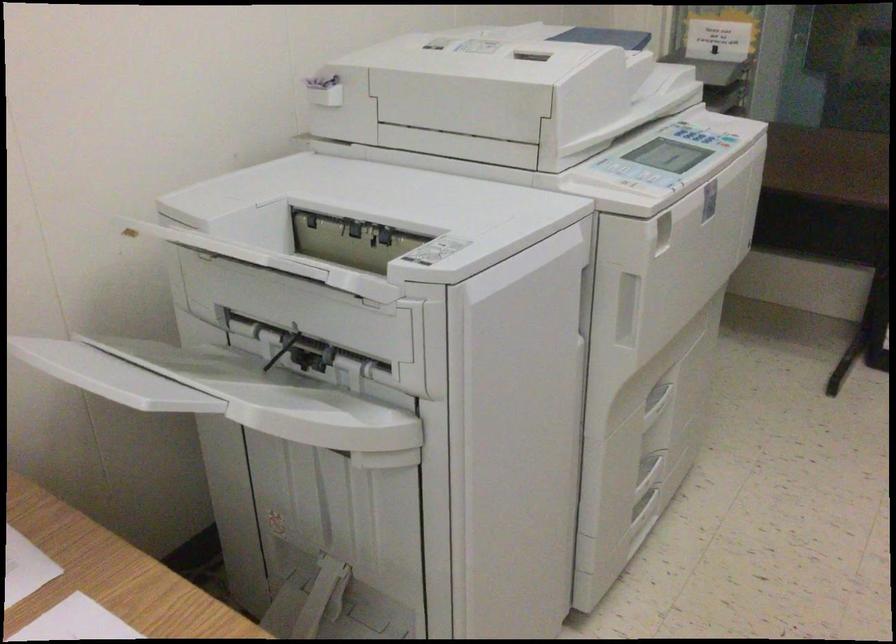
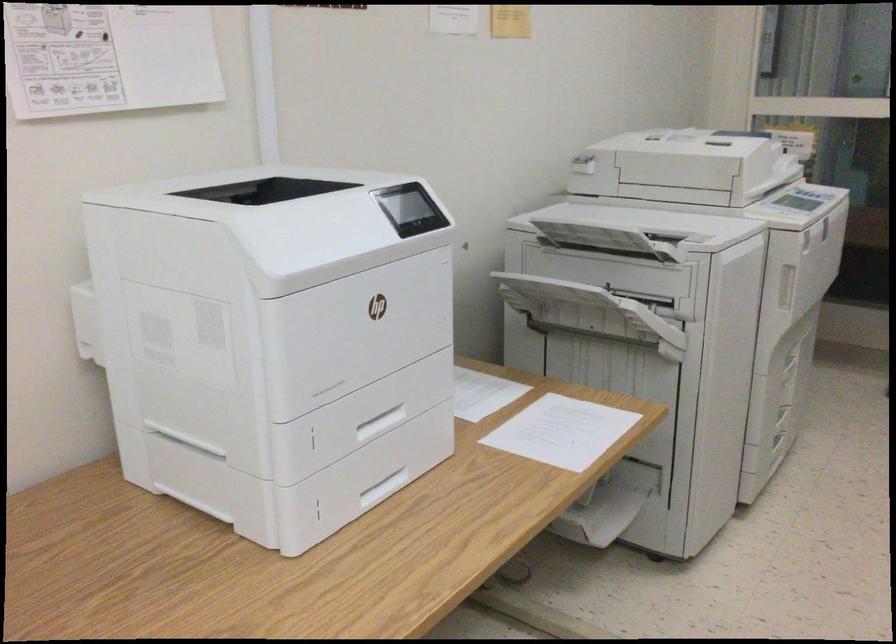
Question: I am providing you with two images of the same scene from different viewpoints. After the viewpoint changes to image2, which objects are now occluded?

Choices:
 (A) open access panel
 (B) scanner lid
 (C) copier output tray
 (D) tan sofa sitting surface

Answer: (A)